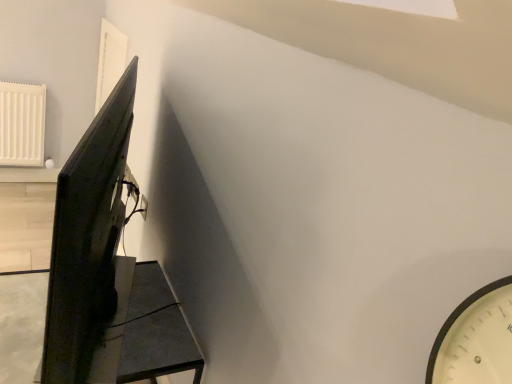
Question: Is the position of matte black table at lower left more distant than that of white plastic electric outlet at upper center?

Choices:
 (A) no
 (B) yes

Answer: (A)

Question: Can you confirm if matte black table at lower left is positioned to the left of white plastic electric outlet at upper center?

Choices:
 (A) no
 (B) yes

Answer: (B)

Question: From a real-world perspective, is matte black table at lower left below white plastic electric outlet at upper center?

Choices:
 (A) no
 (B) yes

Answer: (B)

Question: Is matte black table at lower left bigger than white plastic electric outlet at upper center?

Choices:
 (A) yes
 (B) no

Answer: (A)

Question: From a real-world perspective, is matte black table at lower left on white plastic electric outlet at upper center?

Choices:
 (A) no
 (B) yes

Answer: (A)

Question: Is matte black table at lower left not within white plastic electric outlet at upper center?

Choices:
 (A) no
 (B) yes

Answer: (B)

Question: Does white plastic electric outlet at upper center turn towards matte black monitor at left?

Choices:
 (A) yes
 (B) no

Answer: (A)

Question: Is white plastic electric outlet at upper center to the right of matte black monitor at left from the viewer's perspective?

Choices:
 (A) no
 (B) yes

Answer: (A)

Question: Is white plastic electric outlet at upper center not inside matte black monitor at left?

Choices:
 (A) yes
 (B) no

Answer: (A)

Question: From the image's perspective, does white plastic electric outlet at upper center appear lower than matte black monitor at left?

Choices:
 (A) yes
 (B) no

Answer: (A)

Question: Does white plastic electric outlet at upper center have a lesser width compared to matte black monitor at left?

Choices:
 (A) no
 (B) yes

Answer: (B)

Question: From a real-world perspective, is white plastic electric outlet at upper center under matte black monitor at left?

Choices:
 (A) yes
 (B) no

Answer: (A)

Question: Is matte black table at lower left facing towards matte black monitor at left?

Choices:
 (A) yes
 (B) no

Answer: (B)